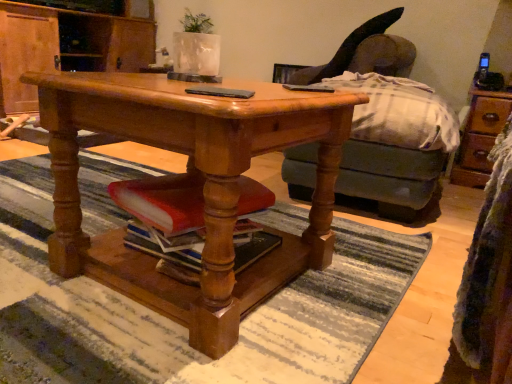
Question: Is white textured vase at upper center to the right of polished wood desk at center from the viewer's perspective?

Choices:
 (A) yes
 (B) no

Answer: (B)

Question: Is white textured vase at upper center to the left of polished wood desk at center from the viewer's perspective?

Choices:
 (A) no
 (B) yes

Answer: (B)

Question: Does white textured vase at upper center contain polished wood desk at center?

Choices:
 (A) yes
 (B) no

Answer: (B)

Question: Is white textured vase at upper center shorter than polished wood desk at center?

Choices:
 (A) yes
 (B) no

Answer: (A)

Question: Is white textured vase at upper center facing towards polished wood desk at center?

Choices:
 (A) no
 (B) yes

Answer: (A)

Question: Considering the positions of point (189, 87) and point (385, 23), is point (189, 87) closer or farther from the camera than point (385, 23)?

Choices:
 (A) farther
 (B) closer

Answer: (B)

Question: Is black matte phone at center bigger or smaller than velvet dark gray swivel chair at upper right?

Choices:
 (A) small
 (B) big

Answer: (A)

Question: In terms of width, does black matte phone at center look wider or thinner when compared to velvet dark gray swivel chair at upper right?

Choices:
 (A) wide
 (B) thin

Answer: (B)

Question: From the image's perspective, is black matte phone at center above or below velvet dark gray swivel chair at upper right?

Choices:
 (A) above
 (B) below

Answer: (B)

Question: Considering the relative positions of velvet dark gray swivel chair at upper right and white textured vase at upper center in the image provided, is velvet dark gray swivel chair at upper right to the left or to the right of white textured vase at upper center?

Choices:
 (A) right
 (B) left

Answer: (A)

Question: Considering the positions of velvet dark gray swivel chair at upper right and white textured vase at upper center in the image, is velvet dark gray swivel chair at upper right bigger or smaller than white textured vase at upper center?

Choices:
 (A) big
 (B) small

Answer: (A)

Question: From their relative heights in the image, would you say velvet dark gray swivel chair at upper right is taller or shorter than white textured vase at upper center?

Choices:
 (A) short
 (B) tall

Answer: (B)

Question: Looking at their shapes, would you say velvet dark gray swivel chair at upper right is wider or thinner than white textured vase at upper center?

Choices:
 (A) thin
 (B) wide

Answer: (B)

Question: From the image's perspective, is wooden cabinet at center positioned above or below velvet dark gray swivel chair at upper right?

Choices:
 (A) below
 (B) above

Answer: (B)

Question: Looking at the image, does wooden cabinet at center seem bigger or smaller compared to velvet dark gray swivel chair at upper right?

Choices:
 (A) big
 (B) small

Answer: (A)